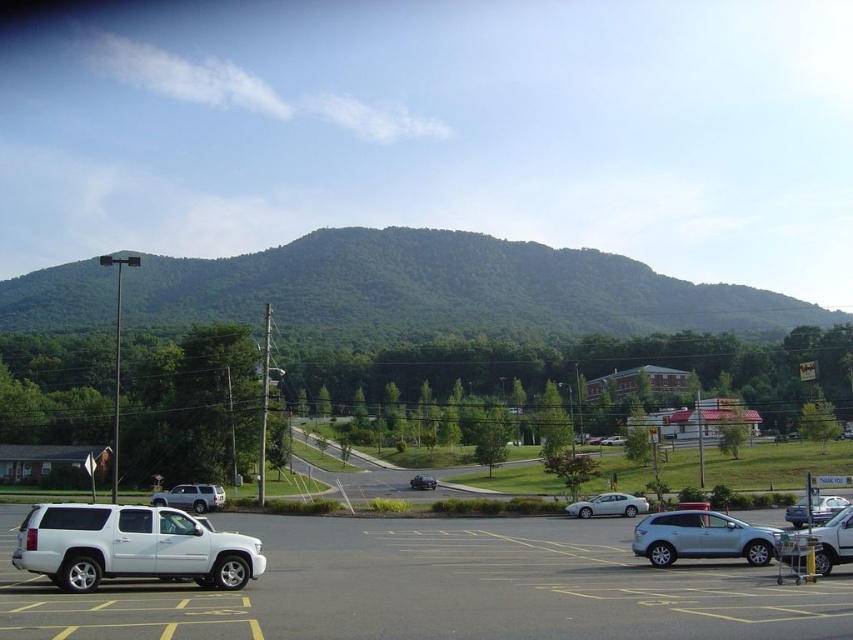
Is white matte suv at left to the left of metallic silver sedan at center right from the viewer's perspective?

Correct, you'll find white matte suv at left to the left of metallic silver sedan at center right.

Between white matte suv at left and metallic silver sedan at center right, which one is positioned higher?

white matte suv at left

Is point (538, 540) positioned behind point (827, 504)?

No.

Locate an element on the screen. This screenshot has height=640, width=853. white matte suv at left is located at coordinates (437, 588).

In the scene shown: Which of these two, metallic silver sedan at center right or silver metallic sedan at center, stands shorter?

With less height is silver metallic sedan at center.

Is metallic silver sedan at center right positioned in front of silver metallic sedan at center?

Yes.

Identify the location of metallic silver sedan at center right. (827, 508).

Which is in front, point (548, 564) or point (635, 500)?

Point (548, 564) is more forward.

Which is behind, point (457, 621) or point (646, 509)?

The point (646, 509) is more distant.

This screenshot has width=853, height=640. I want to click on white matte suv at left, so coord(437,588).